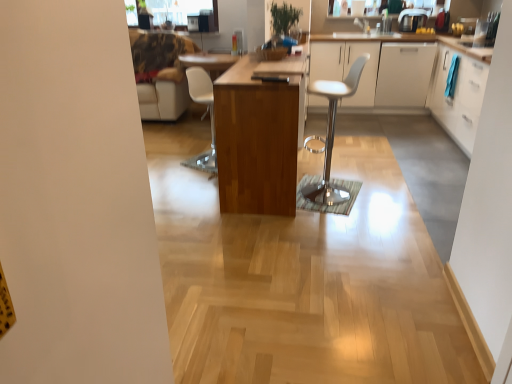
Question: Is white glossy cabinet at upper right, which is the first cabinetry from left to right, far away from white matte cabinet at right, placed as the 2th cabinetry when sorted from right to left?

Choices:
 (A) no
 (B) yes

Answer: (A)

Question: Is white glossy cabinet at upper right, the fourth cabinetry from the right, shorter than white matte cabinet at right, which appears as the 3th cabinetry when viewed from the left?

Choices:
 (A) yes
 (B) no

Answer: (B)

Question: Considering the relative sizes of white glossy cabinet at upper right, which is the first cabinetry from left to right, and white matte cabinet at right, which appears as the 3th cabinetry when viewed from the left, in the image provided, is white glossy cabinet at upper right, which is the first cabinetry from left to right, thinner than white matte cabinet at right, which appears as the 3th cabinetry when viewed from the left,?

Choices:
 (A) no
 (B) yes

Answer: (B)

Question: Is white glossy cabinet at upper right, which is the first cabinetry from left to right, positioned with its back to white matte cabinet at right, placed as the 2th cabinetry when sorted from right to left?

Choices:
 (A) yes
 (B) no

Answer: (A)

Question: From a real-world perspective, is white glossy cabinet at upper right, the fourth cabinetry from the right, positioned under white matte cabinet at right, which appears as the 3th cabinetry when viewed from the left, based on gravity?

Choices:
 (A) yes
 (B) no

Answer: (B)

Question: Considering the positions of metallic silver coffee maker at upper right and wooden table at center in the image, is metallic silver coffee maker at upper right taller or shorter than wooden table at center?

Choices:
 (A) tall
 (B) short

Answer: (B)

Question: From the image's perspective, is metallic silver coffee maker at upper right positioned above or below wooden table at center?

Choices:
 (A) above
 (B) below

Answer: (A)

Question: Does point (418, 24) appear closer or farther from the camera than point (249, 92)?

Choices:
 (A) closer
 (B) farther

Answer: (B)

Question: From a real-world perspective, is metallic silver coffee maker at upper right above or below wooden table at center?

Choices:
 (A) below
 (B) above

Answer: (B)

Question: Looking at their shapes, would you say white glossy cabinet at upper right, the fourth cabinetry from the right, is wider or thinner than white plastic chair at center, the first chair when ordered from left to right?

Choices:
 (A) wide
 (B) thin

Answer: (A)

Question: In the image, is white glossy cabinet at upper right, which is the first cabinetry from left to right, on the left side or the right side of white plastic chair at center, arranged as the second chair when viewed from the front?

Choices:
 (A) left
 (B) right

Answer: (B)

Question: Does point (379, 54) appear closer or farther from the camera than point (197, 168)?

Choices:
 (A) closer
 (B) farther

Answer: (B)

Question: From a real-world perspective, relative to white plastic chair at center, the first chair from the back, is white glossy cabinet at upper right, the fourth cabinetry from the right, vertically above or below?

Choices:
 (A) above
 (B) below

Answer: (A)

Question: Would you say transparent glass window screen at upper center is inside or outside white glossy cabinet at right, the 1th cabinetry positioned from the right?

Choices:
 (A) outside
 (B) inside

Answer: (A)

Question: Would you say transparent glass window screen at upper center is to the left or to the right of white glossy cabinet at right, the 4th cabinetry when ordered from left to right, in the picture?

Choices:
 (A) right
 (B) left

Answer: (B)